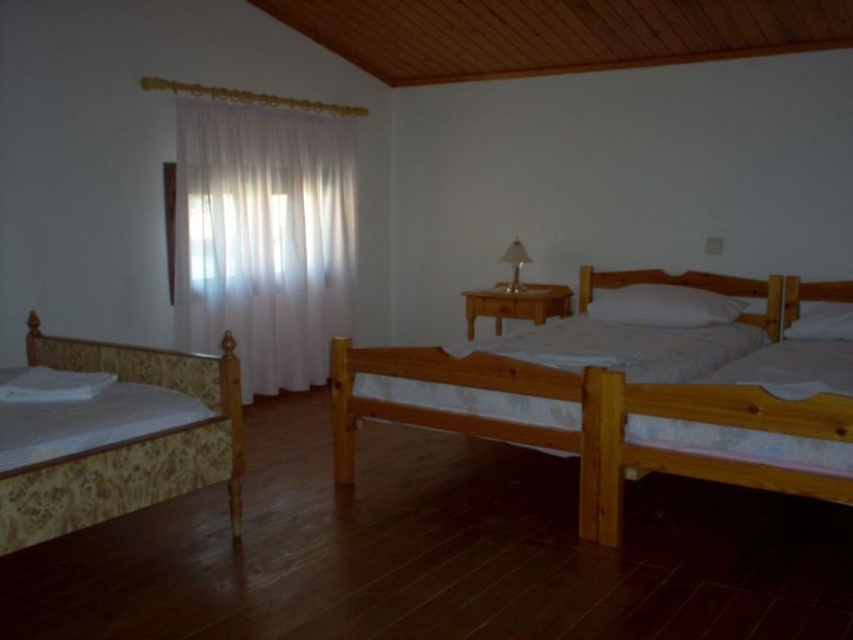
What do you see at coordinates (706, 442) in the screenshot?
I see `light brown wooden bed at right` at bounding box center [706, 442].

Can you confirm if light brown wooden bed at right is thinner than light brown wooden bed at center?

Yes, light brown wooden bed at right is thinner than light brown wooden bed at center.

Describe the element at coordinates (706, 442) in the screenshot. I see `light brown wooden bed at right` at that location.

The image size is (853, 640). What are the coordinates of `light brown wooden bed at right` in the screenshot? It's located at coord(706,442).

At what (x,y) coordinates should I click in order to perform the action: click on light wood table at center. Please return your answer as a coordinate pair (x, y). The height and width of the screenshot is (640, 853). Looking at the image, I should click on (515, 304).

Can you confirm if light wood table at center is smaller than white soft pillow at right?

No, light wood table at center is not smaller than white soft pillow at right.

Locate an element on the screen. This screenshot has width=853, height=640. light wood table at center is located at coordinates (515, 304).

Identify the location of light wood table at center. (515, 304).

How much distance is there between light brown wooden bed at center and white soft pillow at right?

The distance of light brown wooden bed at center from white soft pillow at right is 2.18 meters.

Which of these two, light brown wooden bed at center or white soft pillow at right, stands taller?

light brown wooden bed at center is taller.

Measure the distance between point (358, 413) and camera.

They are 3.59 meters apart.

At what (x,y) coordinates should I click in order to perform the action: click on light brown wooden bed at center. Please return your answer as a coordinate pair (x, y). This screenshot has width=853, height=640. Looking at the image, I should click on (466, 413).